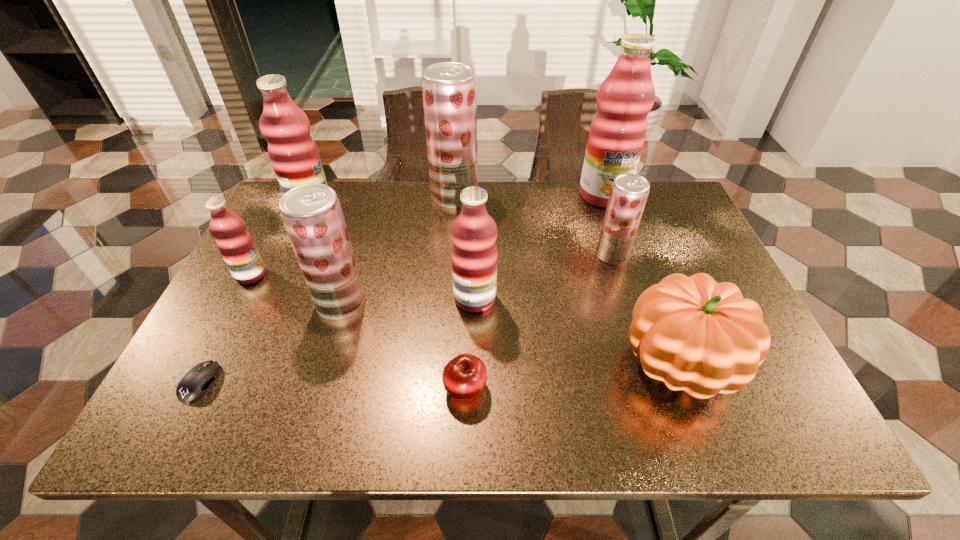
The image size is (960, 540). I want to click on free region located 0.120m on the label of the third biggest pink fruit juice, so click(546, 298).

At what (x,y) coordinates should I click in order to perform the action: click on vacant point located on the label of the smallest pink fruit juice. Please return your answer as a coordinate pair (x, y). This screenshot has height=540, width=960. Looking at the image, I should click on (396, 275).

Find the location of a particular element. The height and width of the screenshot is (540, 960). free space located on the front of the rightmost strawberry fruit juice is located at coordinates (639, 342).

At what (x,y) coordinates should I click in order to perform the action: click on free space located on the back of the orange pumpkin. Please return your answer as a coordinate pair (x, y). The width and height of the screenshot is (960, 540). Looking at the image, I should click on pyautogui.click(x=629, y=232).

Find the location of `vacant space located on the back of the pink apple`. vacant space located on the back of the pink apple is located at coordinates (468, 261).

Locate an element on the screen. This screenshot has height=540, width=960. free space located on the right of the black computer equipment is located at coordinates (255, 382).

Locate an element on the screen. The image size is (960, 540). pumpkin that is at the near edge is located at coordinates (696, 335).

The height and width of the screenshot is (540, 960). In order to click on apple at the near edge in this screenshot , I will do `click(464, 377)`.

At what (x,y) coordinates should I click in order to perform the action: click on computer equipment that is at the near edge. Please return your answer as a coordinate pair (x, y). This screenshot has width=960, height=540. Looking at the image, I should click on (195, 382).

I want to click on computer equipment that is at the left edge, so click(195, 382).